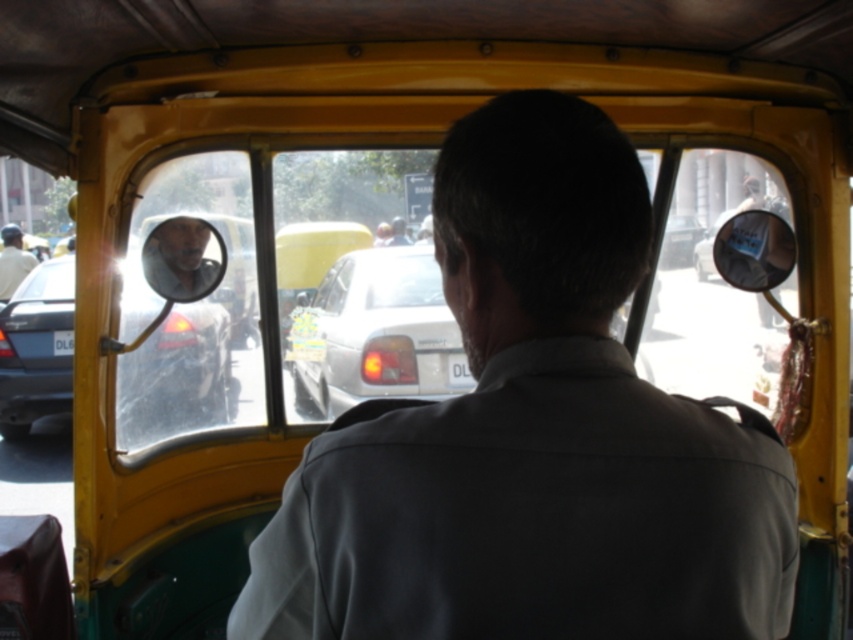
Which is more to the right, white glossy sedan at center or whiteplasticlicense plate at left?

From the viewer's perspective, white glossy sedan at center appears more on the right side.

At what (x,y) coordinates should I click in order to perform the action: click on white glossy sedan at center. Please return your answer as a coordinate pair (x, y). The height and width of the screenshot is (640, 853). Looking at the image, I should click on 372,332.

You are a GUI agent. You are given a task and a screenshot of the screen. Output one action in this format:
    pyautogui.click(x=<x>, y=<y>)
    Task: Click on the white glossy sedan at center
    The width and height of the screenshot is (853, 640).
    Given the screenshot: What is the action you would take?
    pyautogui.click(x=372, y=332)

Between point (270, 573) and point (693, 236), which one is positioned in front?

Point (270, 573)

Can you confirm if gray fabric shirt at center is bigger than metallic silver car at center?

No.

Between point (561, 465) and point (666, 224), which one is positioned behind?

The point (666, 224) is behind.

I want to click on gray fabric shirt at center, so click(x=532, y=436).

Between light beige shirt at left and whiteplasticlicense plate at left, which one has less height?

With less height is whiteplasticlicense plate at left.

Does point (9, 253) come farther from viewer compared to point (70, 333)?

That is True.

Identify the location of light beige shirt at left. (12, 260).